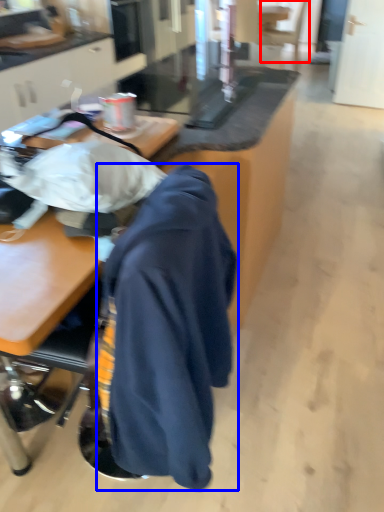
Question: Which object is closer to the camera taking this photo, swivel chair (highlighted by a red box) or cloak (highlighted by a blue box)?

Choices:
 (A) swivel chair
 (B) cloak

Answer: (B)